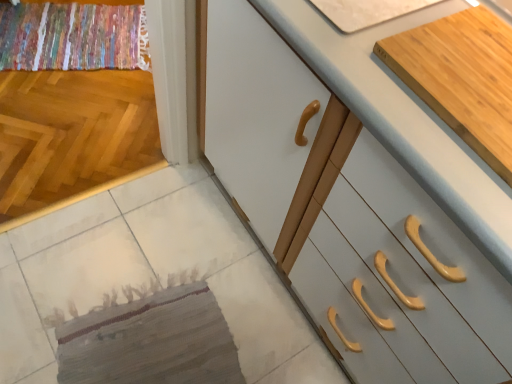
Question: Choose the correct answer: Is white glossy cabinet at center, which is the 2th cabinetry in back-to-front order, inside light wood cutting board at upper right, which ranks as the first cabinetry in back-to-front order, or outside it?

Choices:
 (A) outside
 (B) inside

Answer: (A)

Question: Considering the positions of point (396, 142) and point (461, 127), is point (396, 142) closer or farther from the camera than point (461, 127)?

Choices:
 (A) farther
 (B) closer

Answer: (B)

Question: Which object is the farthest from the light wood cutting board at upper right, which is the second cabinetry from front to back?

Choices:
 (A) multicolored woven rug at upper left
 (B) textured beige mat at lower left
 (C) white glossy cabinet at center, the 1th cabinetry positioned from the front

Answer: (A)

Question: Considering the real-world distances, which object is closest to the textured beige mat at lower left?

Choices:
 (A) multicolored woven rug at upper left
 (B) light wood cutting board at upper right, which ranks as the first cabinetry in back-to-front order
 (C) white glossy cabinet at center, the 1th cabinetry positioned from the front

Answer: (C)